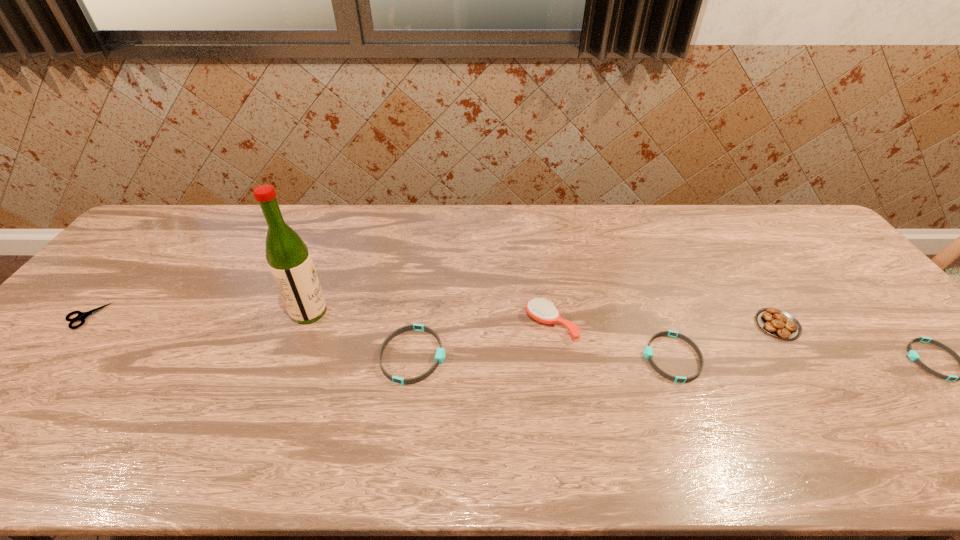
Identify the location of liquor. (289, 260).

Identify the location of vacant space situated 0.160m on the buckle of the fifth object from right to left. (510, 355).

I want to click on free space located 0.150m on the buckle of the second wristband from right to left, so click(584, 357).

In order to click on free location located on the buckle of the second wristband from right to left in this screenshot , I will do point(507,357).

The image size is (960, 540). I want to click on free region located on the buckle of the second wristband from right to left, so click(x=588, y=357).

Locate an element on the screen. The image size is (960, 540). free space located 0.070m on the left of the hairbrush is located at coordinates (500, 325).

Find the location of a particular element. This screenshot has height=540, width=960. vacant area situated on the back of the shortest object is located at coordinates (109, 291).

In order to click on free region located on the left of the pastry in this screenshot , I will do `click(607, 325)`.

The width and height of the screenshot is (960, 540). In order to click on vacant area situated 0.260m on the label of the tallest object in this screenshot , I will do `click(421, 312)`.

The image size is (960, 540). I want to click on object present at the left edge, so click(81, 316).